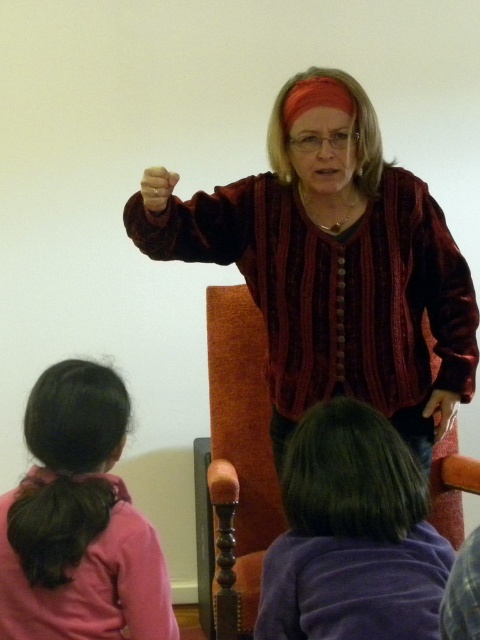
From the picture: You are a photographer trying to capture a closeup of the pink fabric hair at lower left and the purple velvet hair at lower center. Since you can only focus on one at a time, which one should you choose to ensure it is in focus if you want the one closer to the camera?

The pink fabric hair at lower left is positioned under the purple velvet hair at lower center, meaning it is closer to the camera. Therefore, to ensure it is in focus, you should choose the pink fabric hair at lower left.

You are a stylist observing two hair accessories in the image. The pink fabric hair at lower left and the purple velvet hair at lower center. Which one takes up more space in the image?

The purple velvet hair at lower center takes up more space in the image because the pink fabric hair at lower left occupies less space than it.

You are a photographer standing in the room. You want to take a closeup photo of the point at coordinates point (163, 579). The camera you are using has a maximum focus range of 1.2 meters. Will the point be in focus?

The point (163, 579) is 1.29 meters away from the camera, which exceeds the maximum focus range of 1.2 meters. Therefore, the point will not be in focus.